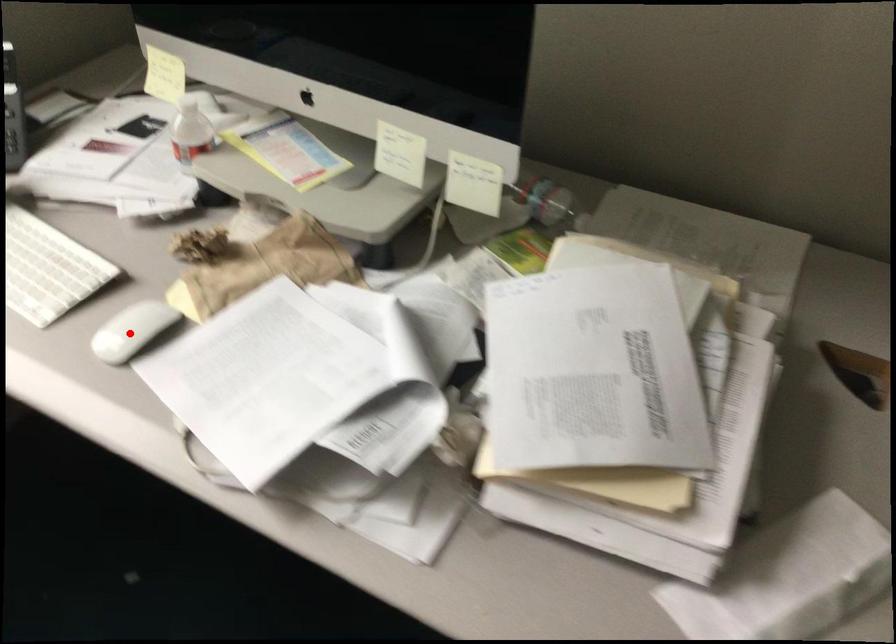
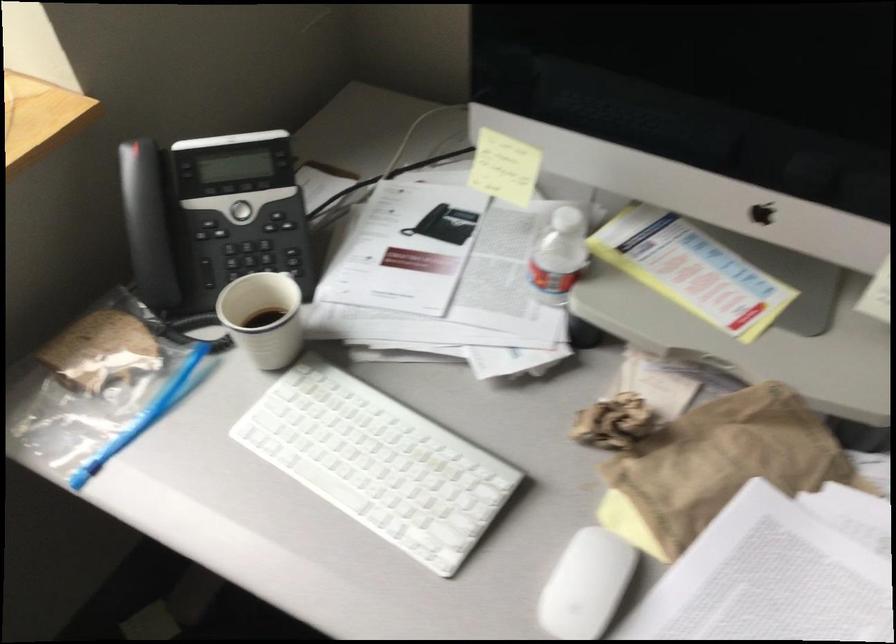
Question: I am providing you with two images of the same scene from different viewpoints. Image1 has a red point marked. In image2, the corresponding 3D location appears at what relative position? Reply with the corresponding letter.

Choices:
 (A) Closer
 (B) Farther

Answer: (A)